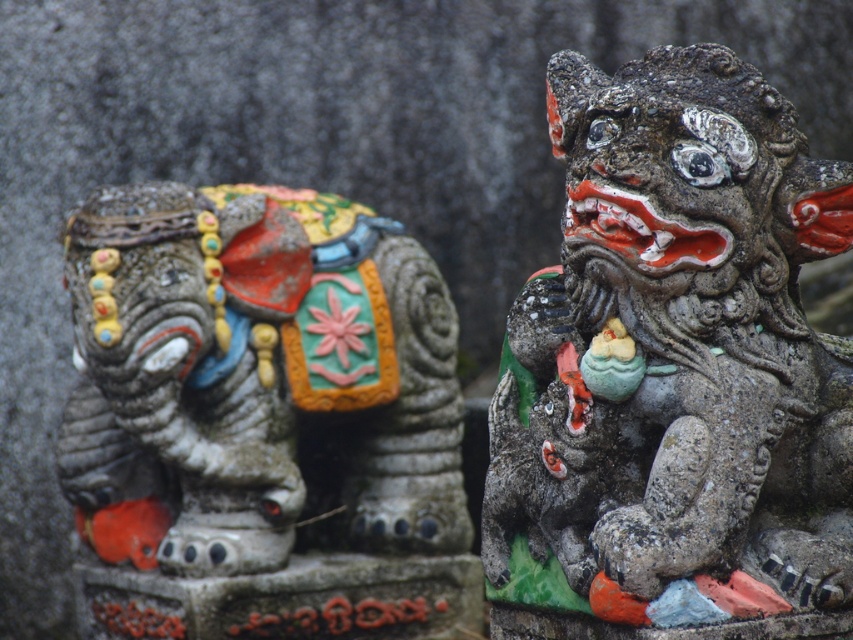
Who is more distant from viewer, (680,388) or (225,486)?

The point (225,486) is more distant.

Between stone lion at right and matte stone elephant at left, which one has less height?

With less height is matte stone elephant at left.

Is point (769, 294) closer to viewer compared to point (222, 221)?

Yes, it is in front of point (222, 221).

Find the location of a particular element. The width and height of the screenshot is (853, 640). stone lion at right is located at coordinates (674, 371).